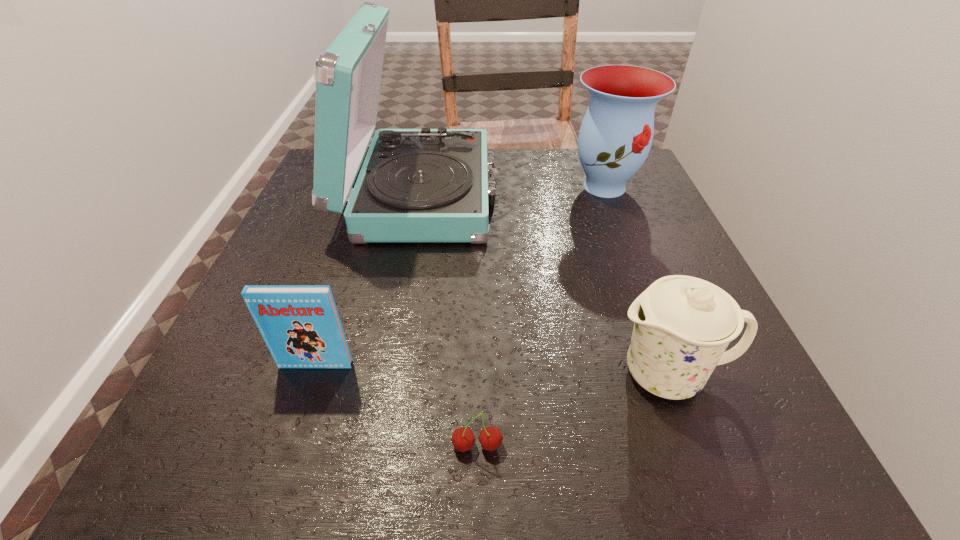
Identify the location of record player. The height and width of the screenshot is (540, 960). (425, 185).

This screenshot has width=960, height=540. What are the coordinates of `the second tallest object` in the screenshot? It's located at [615, 137].

Identify the location of chinaware. The height and width of the screenshot is (540, 960). (683, 324).

Find the location of a particular element. book is located at coordinates (300, 324).

In order to click on cherry in this screenshot , I will do `click(490, 438)`.

Where is `the nearest object`? the nearest object is located at coordinates (490, 438).

Where is `vacant space located 0.200m on the face side of the tallest object`? vacant space located 0.200m on the face side of the tallest object is located at coordinates (584, 194).

I want to click on vacant space situated 0.120m on the front of the fourth shortest object, so click(x=626, y=242).

Find the location of a particular element. vacant area situated 0.390m on the spout of the chinaware is located at coordinates (350, 374).

Where is `vacant region located 0.400m on the spout of the chinaware`? The height and width of the screenshot is (540, 960). vacant region located 0.400m on the spout of the chinaware is located at coordinates (344, 374).